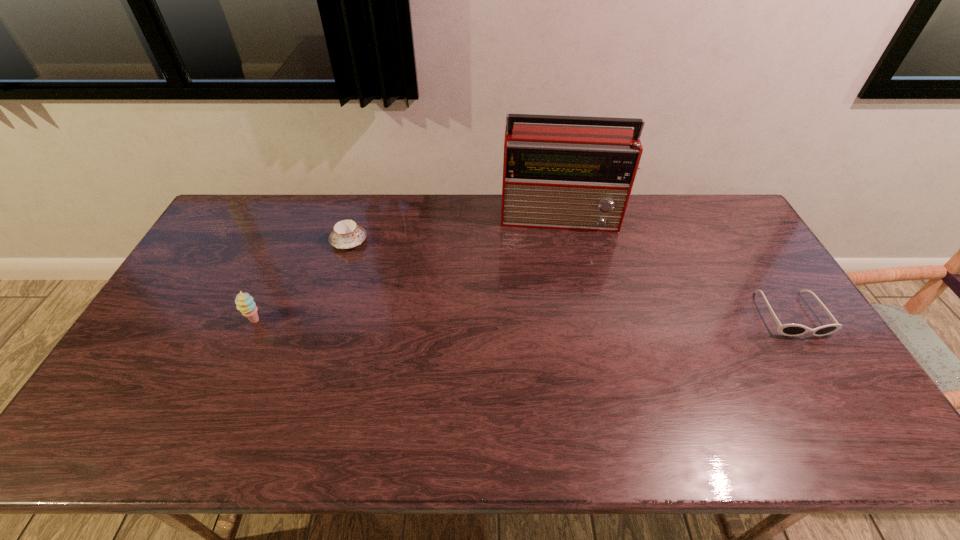
Where is `the second tallest object`? This screenshot has height=540, width=960. the second tallest object is located at coordinates coord(244,302).

What are the coordinates of `sherbert` in the screenshot? It's located at (244, 302).

Locate an element on the screen. Image resolution: width=960 pixels, height=540 pixels. sunglasses is located at coordinates (787, 329).

Locate an element on the screen. The width and height of the screenshot is (960, 540). the rightmost object is located at coordinates (787, 329).

The width and height of the screenshot is (960, 540). What are the coordinates of `radio receiver` in the screenshot? It's located at (568, 177).

I want to click on the tallest object, so click(x=568, y=177).

At what (x,y) coordinates should I click in order to perform the action: click on the second object from left to right. Please return your answer as a coordinate pair (x, y). This screenshot has width=960, height=540. Looking at the image, I should click on (347, 234).

Where is `teacup`? The width and height of the screenshot is (960, 540). teacup is located at coordinates (347, 234).

This screenshot has height=540, width=960. I want to click on free region located on the right of the third shortest object, so click(x=368, y=321).

You are a GUI agent. You are given a task and a screenshot of the screen. Output one action in this format:
    pyautogui.click(x=<x>, y=<y>)
    Task: Click on the vacant region located 0.100m with the lenses of the sunglasses facing outward
    The width and height of the screenshot is (960, 540).
    Given the screenshot: What is the action you would take?
    pyautogui.click(x=826, y=370)